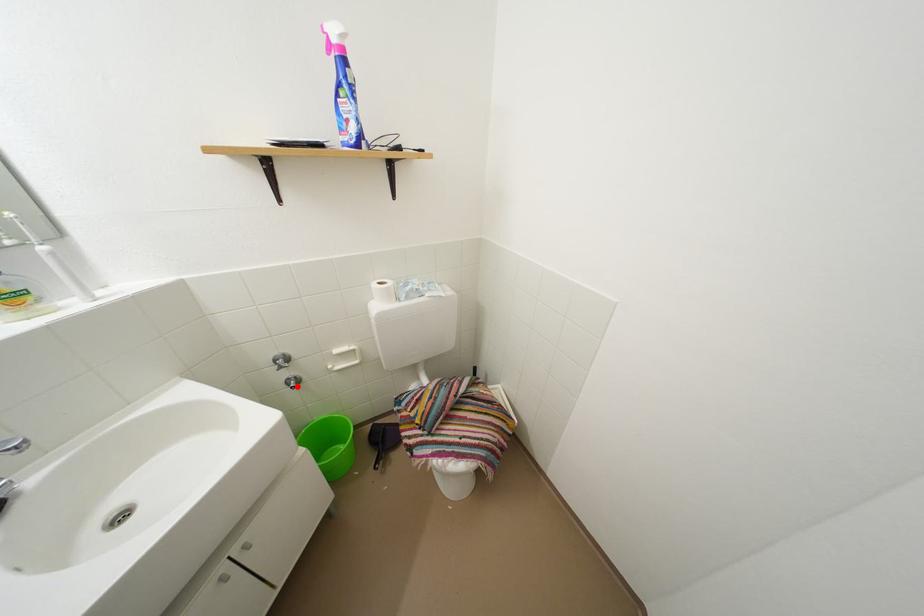
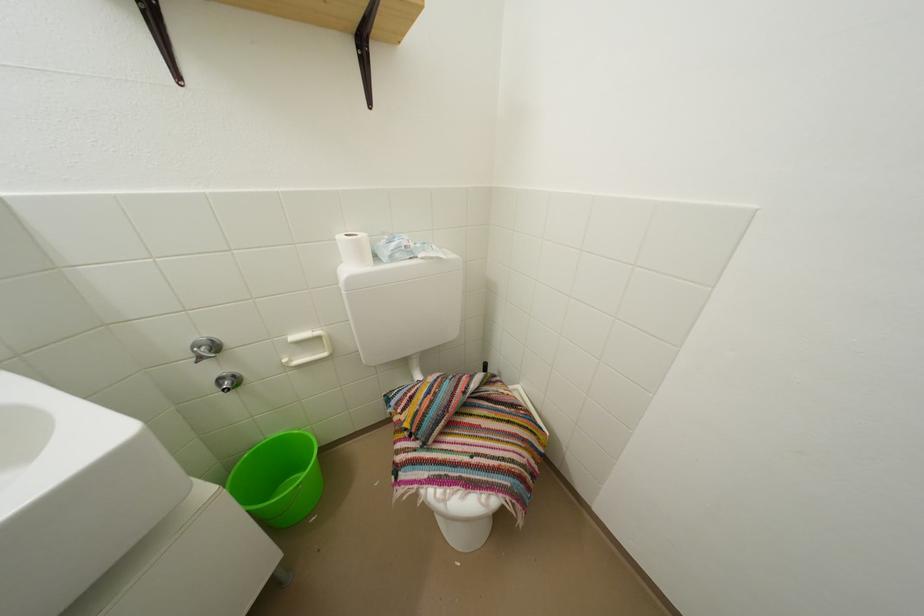
Where in the second image is the point corresponding to the highlighted location from the first image?

(229, 386)